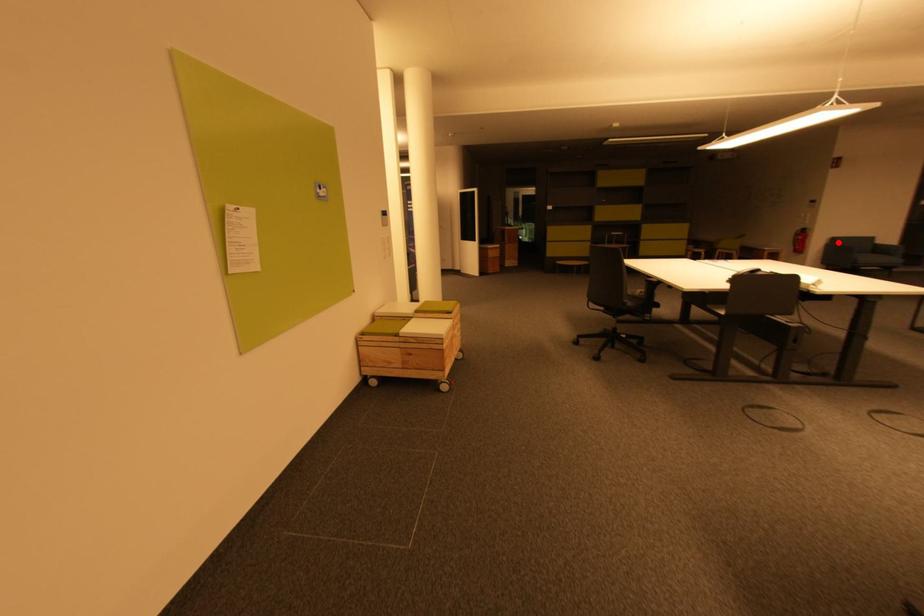
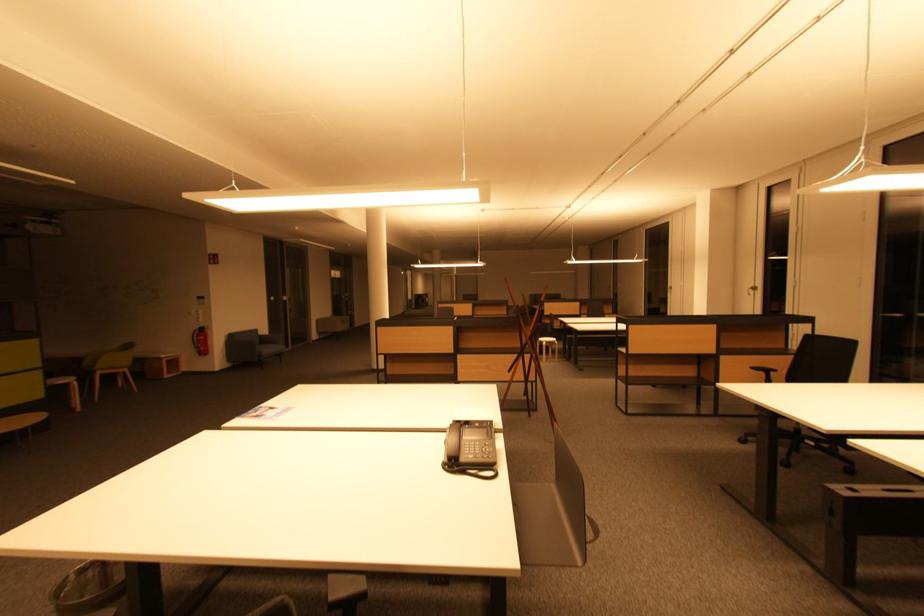
In the second image, find the point that corresponds to the highlighted location in the first image.

(236, 339)